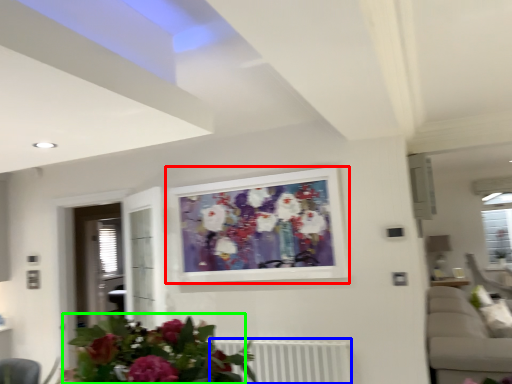
Question: Which object is positioned closest to picture frame (highlighted by a red box)? Select from radiator (highlighted by a blue box) and floral arrangement (highlighted by a green box).

Choices:
 (A) radiator
 (B) floral arrangement

Answer: (A)